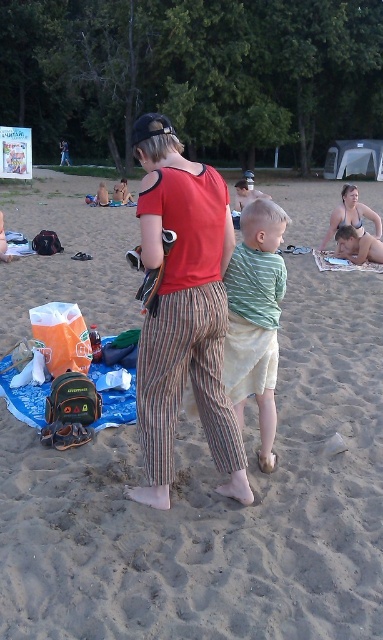
Is green striped shirt at center positioned behind smooth tan skin at lower right?

That is False.

Which is more to the left, green striped shirt at center or smooth tan skin at lower right?

From the viewer's perspective, green striped shirt at center appears more on the left side.

What are the coordinates of `green striped shirt at center` in the screenshot? It's located at (255, 317).

What are the coordinates of `green striped shirt at center` in the screenshot? It's located at (255, 317).

Between point (324, 241) and point (368, 243), which one is positioned behind?

Point (324, 241)

Based on the photo, does matte black bikini top at upper right have a larger size compared to smooth tan skin at lower right?

Yes.

Locate an element on the screen. The width and height of the screenshot is (383, 640). matte black bikini top at upper right is located at coordinates (350, 216).

Does green striped shirt at center have a lesser height compared to matte black bikini top at upper right?

In fact, green striped shirt at center may be taller than matte black bikini top at upper right.

Locate an element on the screen. The width and height of the screenshot is (383, 640). green striped shirt at center is located at coordinates (255, 317).

Identify the location of green striped shirt at center. Image resolution: width=383 pixels, height=640 pixels. (255, 317).